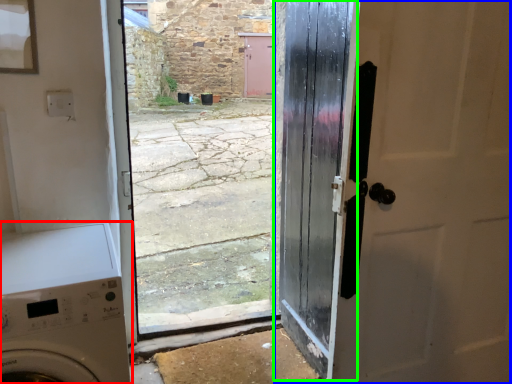
Question: Which object is the closest to the washing machine (highlighted by a red box)? Choose among these: door (highlighted by a blue box) or door (highlighted by a green box).

Choices:
 (A) door
 (B) door

Answer: (B)